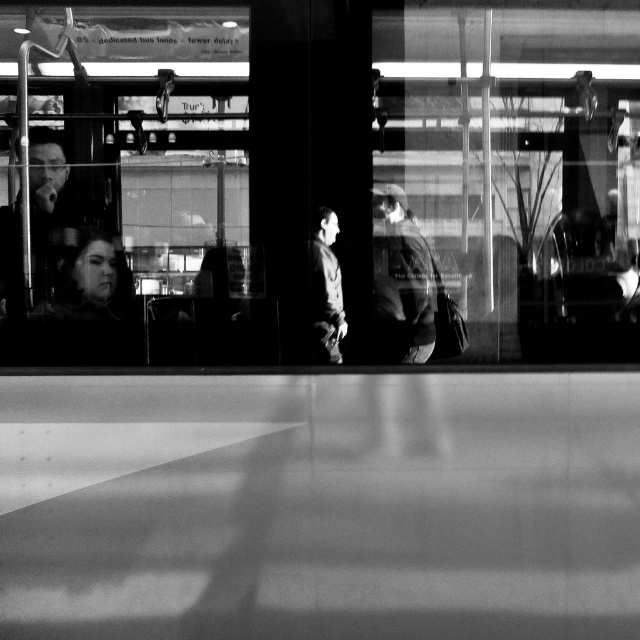
You are observing two people wearing jackets in the center of the image. Which jacket, the dark fabric jacket at center or the dark gray jacket at center, is located to the right?

The dark fabric jacket at center is positioned on the right side of the dark gray jacket at center, so the dark fabric jacket at center is located to the right.

You are a delivery person who needs to hand a package to the person wearing the dark fabric jacket at center. You are currently standing at the entrance of the terminal. The delivery robot you are using has a maximum reach of 3 meters. Can you deliver the package without moving the robot?

The dark fabric jacket at center is 2.99 meters away from your current position at the entrance. Since the delivery robot has a maximum reach of 3 meters, you can deliver the package without moving the robot because 2.99 meters is within the 3 meters range.